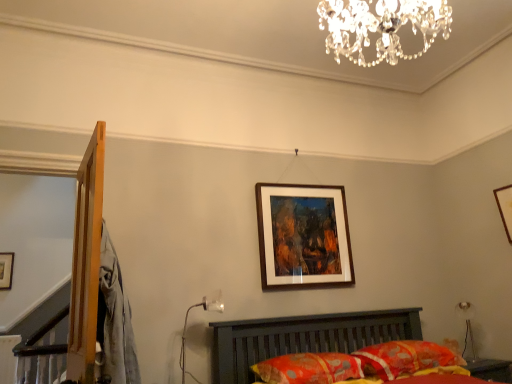
Question: Can you confirm if wooden-framed painting at center, acting as the 2th picture frame starting from the left, is thinner than metallic glass table lamp at lower center, marked as the 1th table lamp in a front-to-back arrangement?

Choices:
 (A) yes
 (B) no

Answer: (A)

Question: From a real-world perspective, is wooden-framed painting at center, acting as the 2th picture frame starting from the left, located higher than metallic glass table lamp at lower center, marked as the 2th table lamp in a back-to-front arrangement?

Choices:
 (A) yes
 (B) no

Answer: (A)

Question: From a real-world perspective, is wooden-framed painting at center, positioned as the 1th picture frame in front-to-back order, physically below metallic glass table lamp at lower center, the first table lamp in the left-to-right sequence?

Choices:
 (A) no
 (B) yes

Answer: (A)

Question: Is wooden-framed painting at center, positioned as the 1th picture frame in front-to-back order, positioned with its back to metallic glass table lamp at lower center, the first table lamp in the left-to-right sequence?

Choices:
 (A) yes
 (B) no

Answer: (B)

Question: Does wooden-framed painting at center, acting as the 2th picture frame starting from the left, appear on the right side of metallic glass table lamp at lower center, marked as the 2th table lamp in a back-to-front arrangement?

Choices:
 (A) no
 (B) yes

Answer: (B)

Question: From a real-world perspective, is metallic silver table lamp at lower right, arranged as the second table lamp when viewed from the left, physically located above or below floral fabric pillow at lower center, arranged as the second pillow when viewed from the left?

Choices:
 (A) above
 (B) below

Answer: (A)

Question: Is metallic silver table lamp at lower right, acting as the 2th table lamp starting from the front, wider or thinner than floral fabric pillow at lower center, arranged as the first pillow when viewed from the right?

Choices:
 (A) thin
 (B) wide

Answer: (A)

Question: From the image's perspective, is metallic silver table lamp at lower right, acting as the 2th table lamp starting from the front, located above or below floral fabric pillow at lower center, arranged as the second pillow when viewed from the left?

Choices:
 (A) below
 (B) above

Answer: (B)

Question: Is point (456, 306) positioned closer to the camera than point (446, 352)?

Choices:
 (A) farther
 (B) closer

Answer: (A)

Question: Looking at the image, does metallic silver table lamp at lower right, arranged as the second table lamp when viewed from the left, seem bigger or smaller compared to wooden picture frame at upper center, the 1th picture frame positioned from the left?

Choices:
 (A) small
 (B) big

Answer: (B)

Question: Is metallic silver table lamp at lower right, the 1th table lamp from the right, to the left or to the right of wooden picture frame at upper center, the 3th picture frame in the front-to-back sequence, in the image?

Choices:
 (A) right
 (B) left

Answer: (A)

Question: Is metallic silver table lamp at lower right, acting as the 2th table lamp starting from the front, in front of or behind wooden picture frame at upper center, the 3th picture frame in the front-to-back sequence, in the image?

Choices:
 (A) front
 (B) behind

Answer: (A)

Question: In terms of height, does metallic silver table lamp at lower right, acting as the 2th table lamp starting from the front, look taller or shorter compared to wooden picture frame at upper center, which ranks as the third picture frame in right-to-left order?

Choices:
 (A) short
 (B) tall

Answer: (B)

Question: From a real-world perspective, is metallic glass table lamp at lower center, which is the second table lamp from right to left, physically located above or below floral fabric pillow at lower center, arranged as the first pillow when viewed from the right?

Choices:
 (A) below
 (B) above

Answer: (B)

Question: Is point (181, 369) positioned closer to the camera than point (462, 365)?

Choices:
 (A) farther
 (B) closer

Answer: (B)